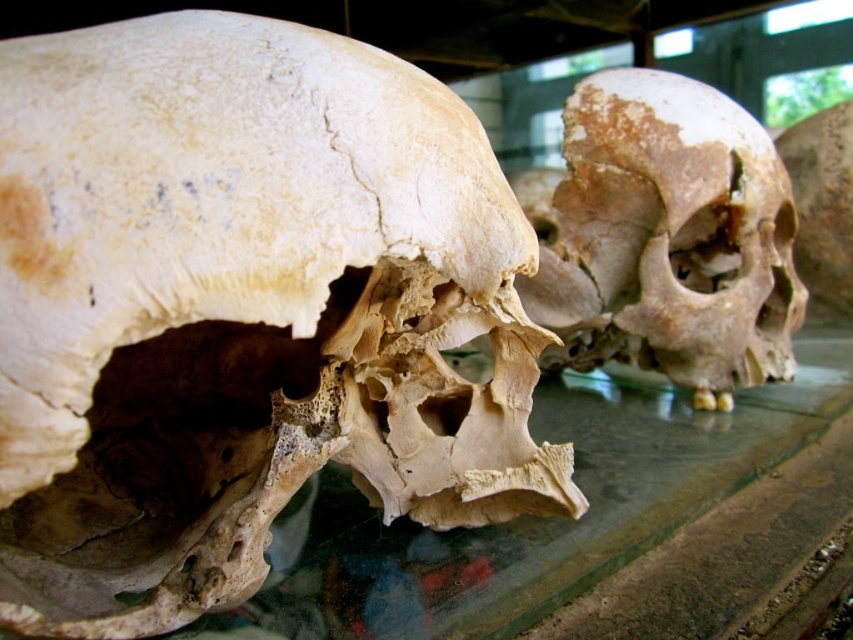
Question: Which object is closer to the camera taking this photo?

Choices:
 (A) brown porous skull at right
 (B) bone-like skull at left
 (C) transparent glass table at center

Answer: (B)

Question: Which object is positioned farthest from the brown porous skull at right?

Choices:
 (A) bone-like skull at left
 (B) transparent glass table at center

Answer: (A)

Question: Considering the relative positions of bone-like skull at left and brown porous skull at right in the image provided, where is bone-like skull at left located with respect to brown porous skull at right?

Choices:
 (A) left
 (B) right

Answer: (A)

Question: Can you confirm if transparent glass table at center is positioned below brown porous skull at right?

Choices:
 (A) yes
 (B) no

Answer: (A)

Question: Which object is closer to the camera taking this photo?

Choices:
 (A) bone-like skull at left
 (B) brown porous skull at right
 (C) transparent glass table at center

Answer: (A)

Question: Can you confirm if bone-like skull at left is wider than transparent glass table at center?

Choices:
 (A) no
 (B) yes

Answer: (A)